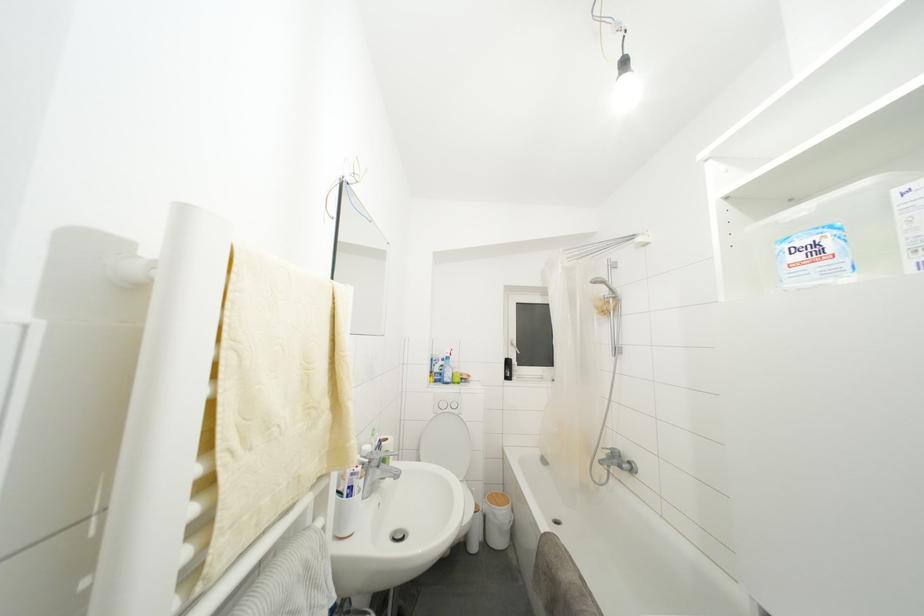
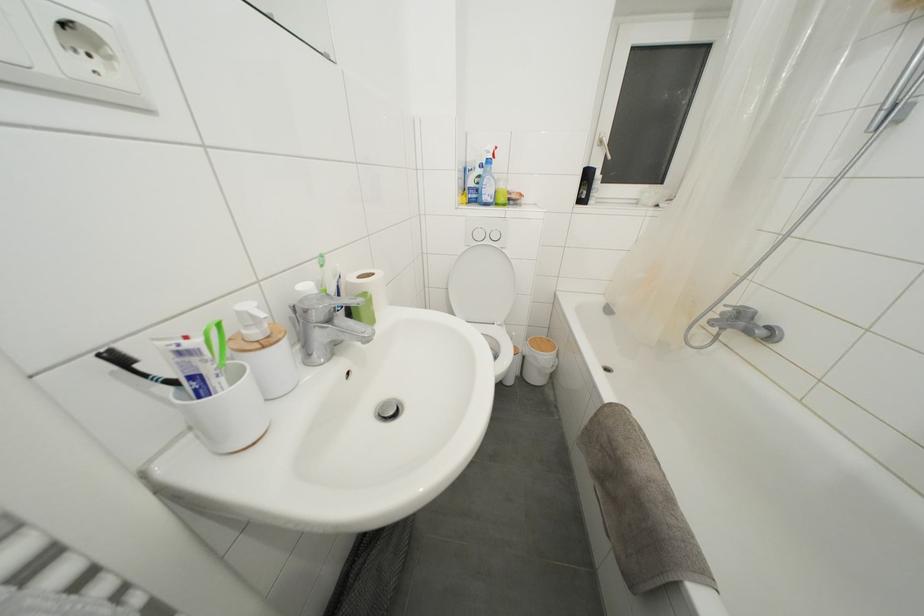
The point at (463, 421) is marked in the first image. Where is the corresponding point in the second image?

(505, 256)